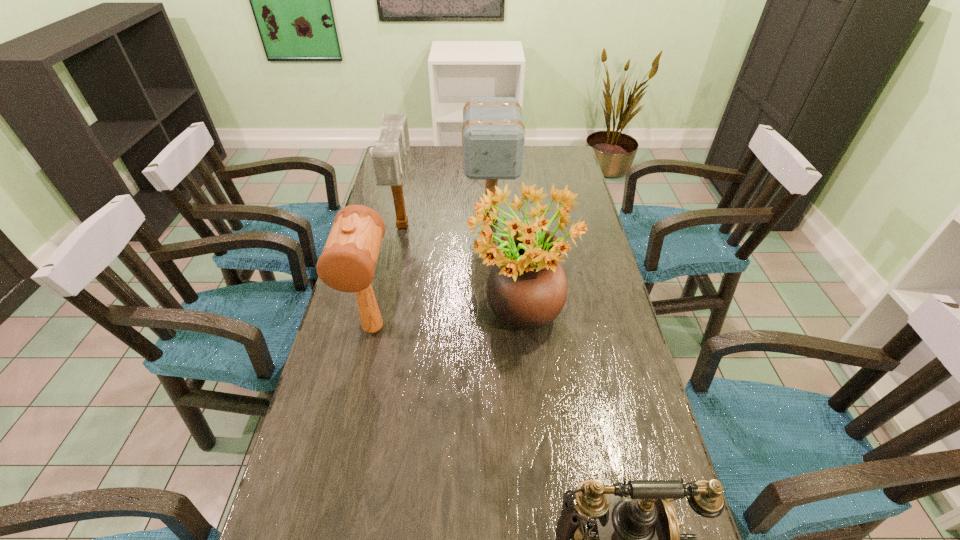
This screenshot has width=960, height=540. I want to click on vacant area that lies between the flower arrangement and the nearest mallet, so click(x=446, y=325).

The height and width of the screenshot is (540, 960). I want to click on unoccupied position between the nearest mallet and the flower arrangement, so click(446, 325).

This screenshot has height=540, width=960. I want to click on the third closest object to the nearest mallet, so click(x=493, y=135).

Locate an element on the screen. Image resolution: width=960 pixels, height=540 pixels. object that stands as the third closest to the flower arrangement is located at coordinates (387, 156).

Identify which mallet is the second nearest to the flower arrangement. Please provide its 2D coordinates. Your answer should be formatted as a tuple, i.e. [(x, y)], where the tuple contains the x and y coordinates of a point satisfying the conditions above.

[(347, 263)]

Select which mallet appears as the second closest to the rightmost mallet. Please provide its 2D coordinates. Your answer should be formatted as a tuple, i.e. [(x, y)], where the tuple contains the x and y coordinates of a point satisfying the conditions above.

[(347, 263)]